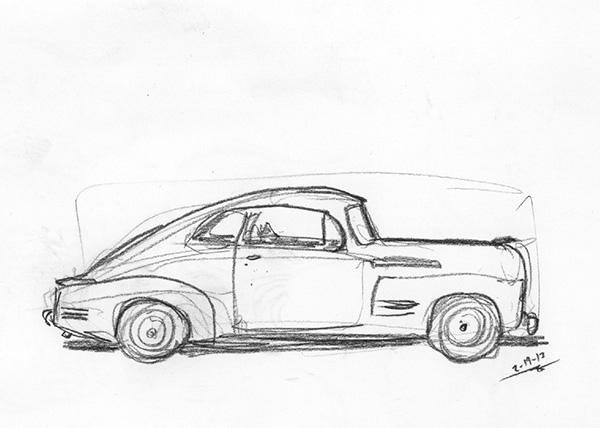
Identify the location of door handle. (253, 257).